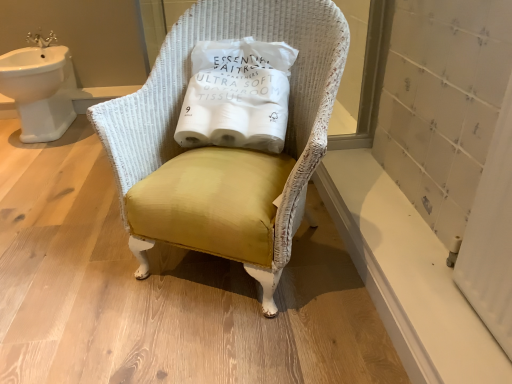
Question: Is white ceramic sink at upper left to the left of mustard velvet chair at center from the viewer's perspective?

Choices:
 (A) yes
 (B) no

Answer: (A)

Question: From a real-world perspective, is white ceramic sink at upper left under mustard velvet chair at center?

Choices:
 (A) no
 (B) yes

Answer: (B)

Question: Would you say white ceramic sink at upper left is outside mustard velvet chair at center?

Choices:
 (A) yes
 (B) no

Answer: (A)

Question: Is white ceramic sink at upper left surrounding mustard velvet chair at center?

Choices:
 (A) no
 (B) yes

Answer: (A)

Question: Is white ceramic sink at upper left at the right side of mustard velvet chair at center?

Choices:
 (A) no
 (B) yes

Answer: (A)

Question: From the image's perspective, would you say white ceramic sink at upper left is positioned over mustard velvet chair at center?

Choices:
 (A) yes
 (B) no

Answer: (A)

Question: Is the position of white smooth window sill at lower right more distant than that of mustard velvet chair at center?

Choices:
 (A) no
 (B) yes

Answer: (B)

Question: Considering the relative sizes of white smooth window sill at lower right and mustard velvet chair at center in the image provided, is white smooth window sill at lower right bigger than mustard velvet chair at center?

Choices:
 (A) yes
 (B) no

Answer: (B)

Question: From a real-world perspective, is white smooth window sill at lower right over mustard velvet chair at center?

Choices:
 (A) yes
 (B) no

Answer: (B)

Question: Can you confirm if white smooth window sill at lower right is positioned to the right of mustard velvet chair at center?

Choices:
 (A) no
 (B) yes

Answer: (B)

Question: Is white smooth window sill at lower right closer to the viewer compared to mustard velvet chair at center?

Choices:
 (A) yes
 (B) no

Answer: (B)

Question: Is white smooth window sill at lower right taller than mustard velvet chair at center?

Choices:
 (A) yes
 (B) no

Answer: (B)

Question: Is white paper toilet paper at center far from white smooth window sill at lower right?

Choices:
 (A) yes
 (B) no

Answer: (B)